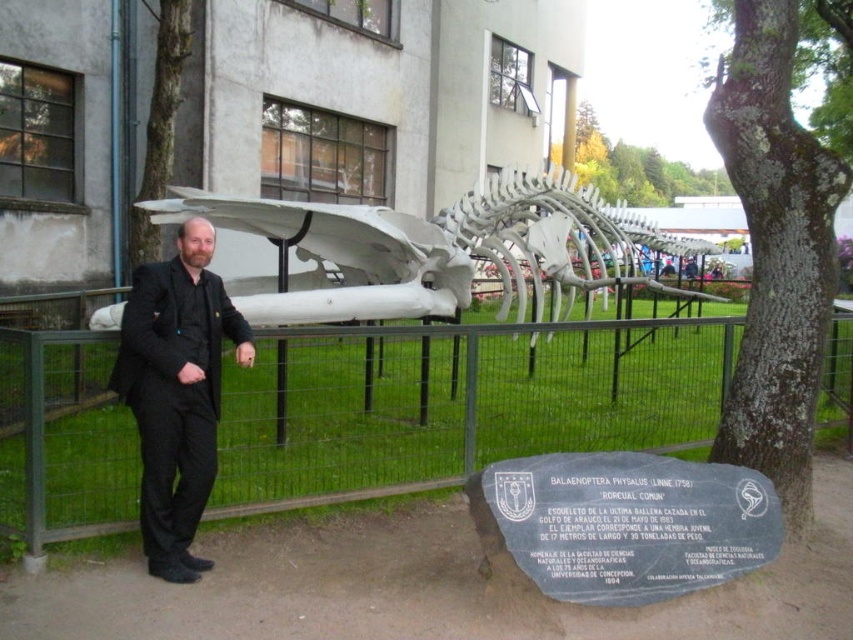
Question: Based on their relative distances, which object is nearer to the white metallic whale skeleton at center?

Choices:
 (A) black fabric suit at left
 (B) metal wire fence at center

Answer: (A)

Question: Can you confirm if metal wire fence at center is bigger than black fabric suit at left?

Choices:
 (A) no
 (B) yes

Answer: (A)

Question: Which of the following is the closest to the observer?

Choices:
 (A) metal wire fence at center
 (B) white metallic whale skeleton at center
 (C) black fabric suit at left

Answer: (C)

Question: Is metal wire fence at center wider than black fabric suit at left?

Choices:
 (A) no
 (B) yes

Answer: (A)

Question: Where is metal wire fence at center located in relation to black fabric suit at left in the image?

Choices:
 (A) above
 (B) below

Answer: (B)

Question: Which object is positioned closest to the white metallic whale skeleton at center?

Choices:
 (A) black fabric suit at left
 (B) metal wire fence at center

Answer: (A)